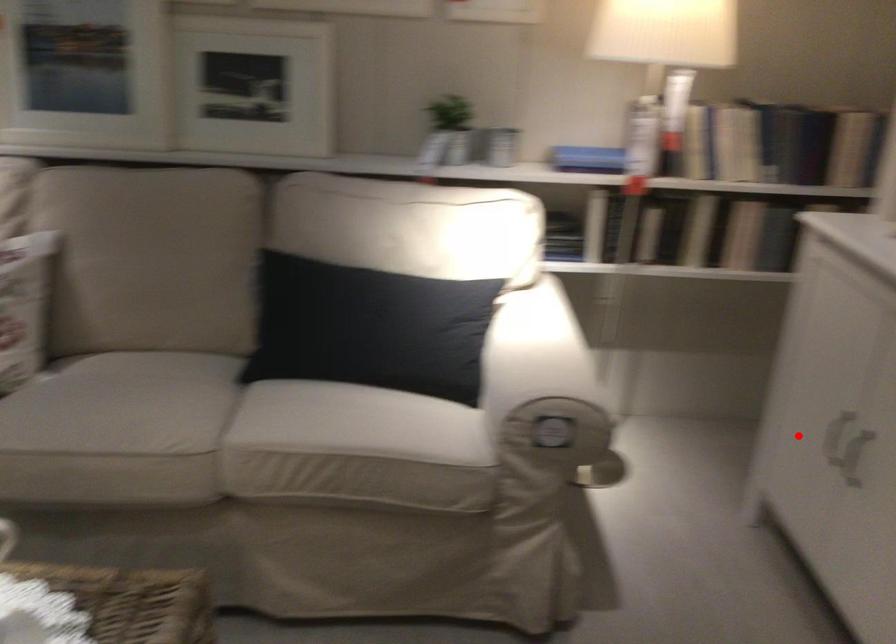
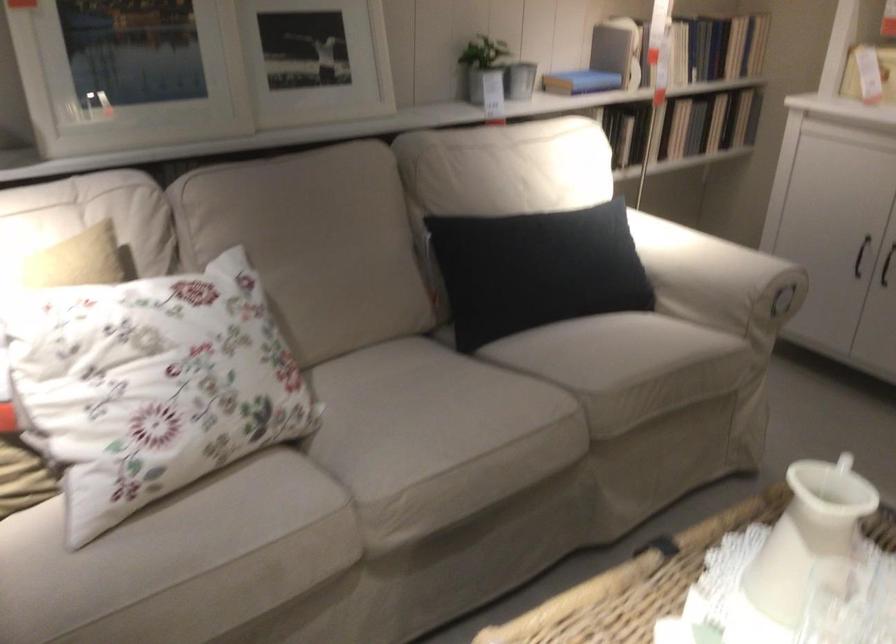
Question: I am providing you with two images of the same scene from different viewpoints. Image1 has a red point marked. In image2, the corresponding 3D location appears at what relative position? Reply with the corresponding letter.

Choices:
 (A) Closer
 (B) Farther

Answer: (B)